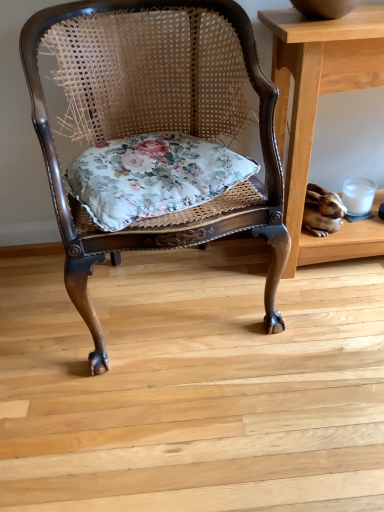
Where is `vacant space underneath rattan chair with floral cushion at center (from a real-world perspective)`? Image resolution: width=384 pixels, height=512 pixels. vacant space underneath rattan chair with floral cushion at center (from a real-world perspective) is located at coordinates (168, 293).